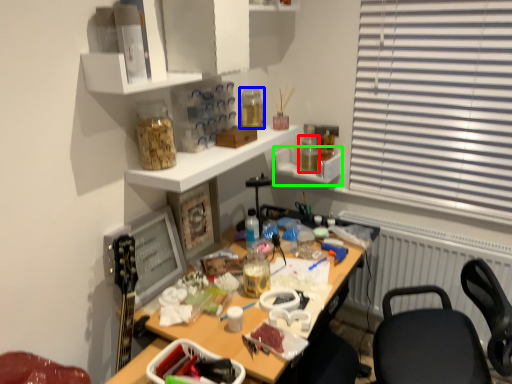
Question: Which is farther away from bottle (highlighted by a red box)? bottle (highlighted by a blue box) or shelf (highlighted by a green box)?

Choices:
 (A) bottle
 (B) shelf

Answer: (A)